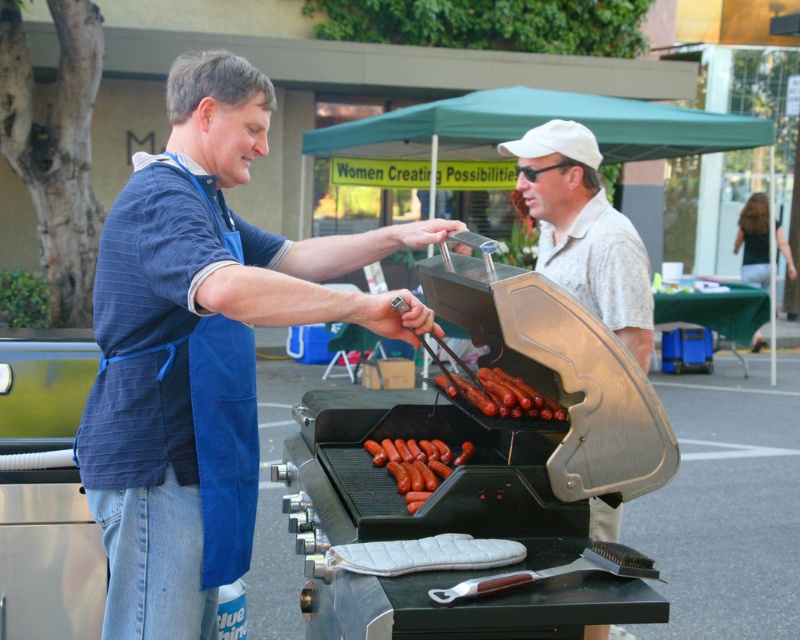
You are a guest at a barbecue and want to grab a sausage from the grill. You see the white cap at upper center and the smooth brown sausages at center. Which object is closer to you?

The white cap at upper center is closer to you than the smooth brown sausages at center because it is further to the viewer.

You are standing at the center of the image and want to hand a tool to the man wearing the blue apron at left. Which direction should you move to approach him?

The blue apron at left is located at point (x=200, y=349), so you should move to the left to approach the man wearing the blue apron at left.

You are a guest at a barbecue and want to grab the smooth brown sausages at center. Which direction should you move relative to the blue apron at left to reach them?

The blue apron at left is positioned on the left side of the smooth brown sausages at center, so you should move to the right from the blue apron at left to reach the sausages.